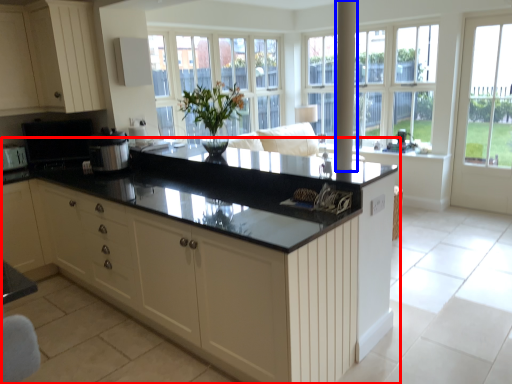
Question: Which object appears closest to the camera in this image, countertop (highlighted by a red box) or pole (highlighted by a blue box)?

Choices:
 (A) countertop
 (B) pole

Answer: (A)